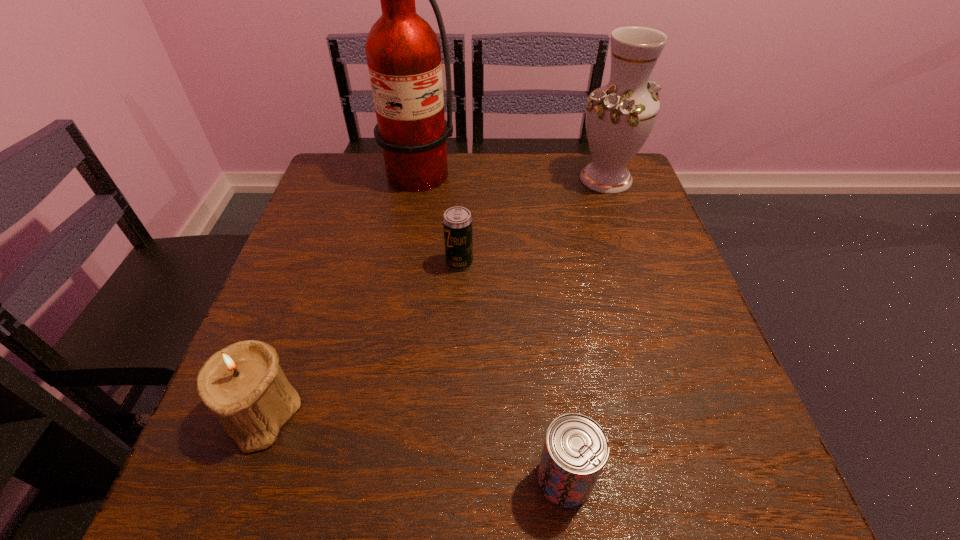
You are a GUI agent. You are given a task and a screenshot of the screen. Output one action in this format:
    pyautogui.click(x=<x>, y=<y>)
    Task: Click on the blank space that satisfies the following two spatial constraints: 1. on the nozzle and handle of the fire extinguisher; 2. on the right side of the rightmost object
    This screenshot has width=960, height=540.
    Given the screenshot: What is the action you would take?
    pyautogui.click(x=402, y=179)